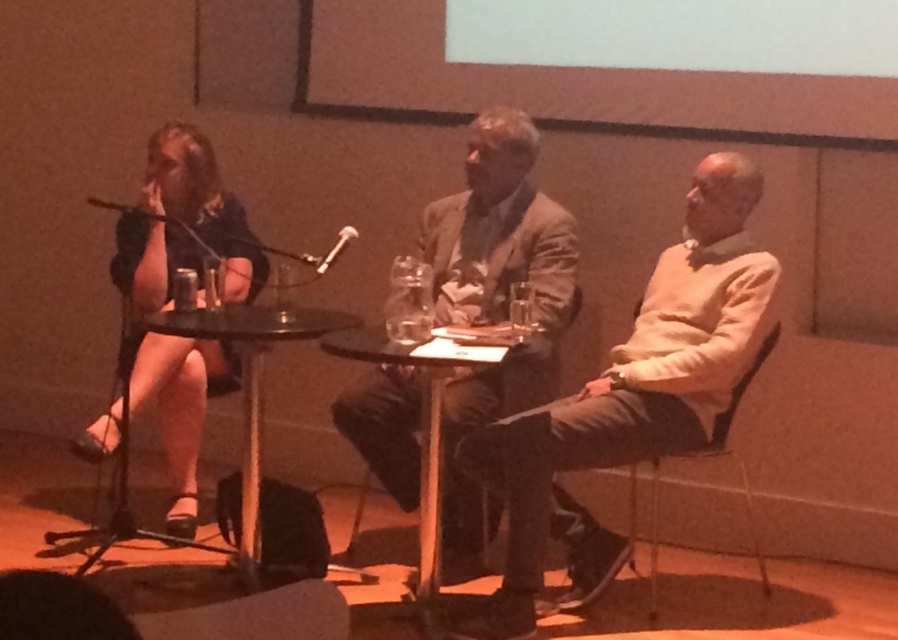
What are the coordinates of the light brown leather jacket at center?

The light brown leather jacket at center is located at coordinates (495, 300).

What is the color and type of the clothing item located at the coordinates point (x=495, y=300) in the image?

The point (x=495, y=300) marks the location of the light brown leather jacket at center.